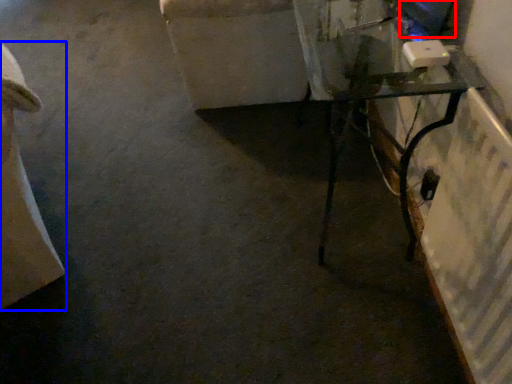
Question: Among these objects, which one is nearest to the camera, computer screen (highlighted by a red box) or furniture (highlighted by a blue box)?

Choices:
 (A) computer screen
 (B) furniture

Answer: (B)